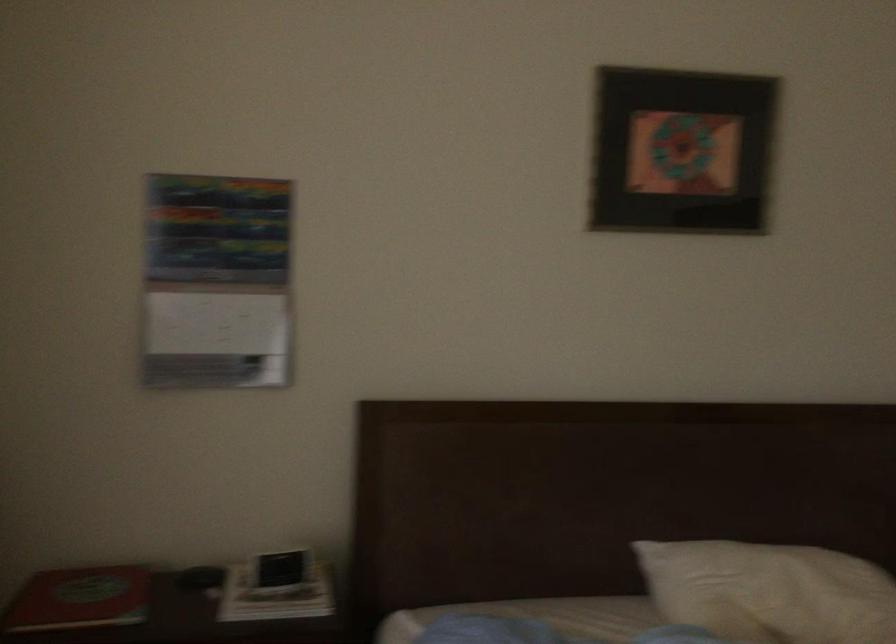
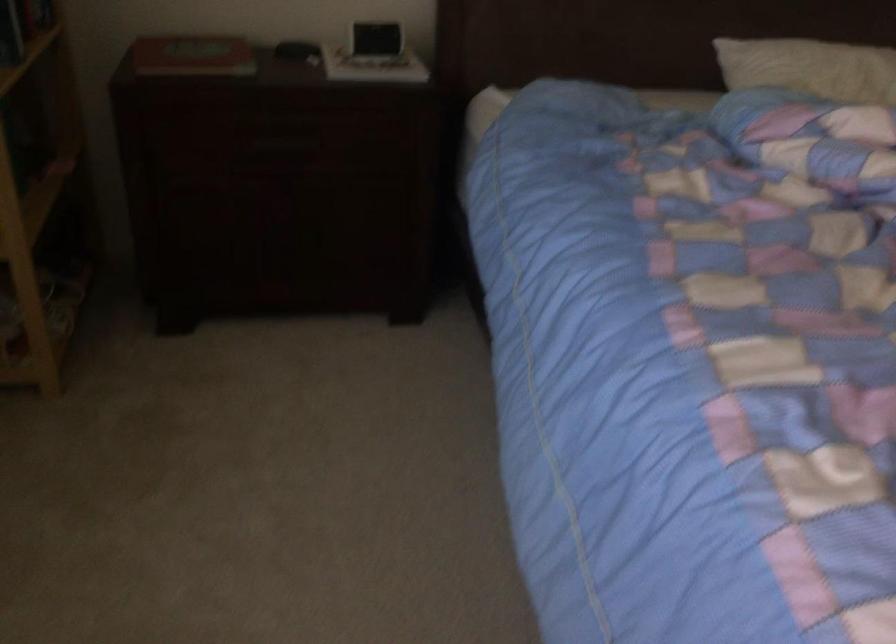
The images are taken continuously from a first-person perspective. In which direction are you moving?

The cameraman moved toward left, backward.